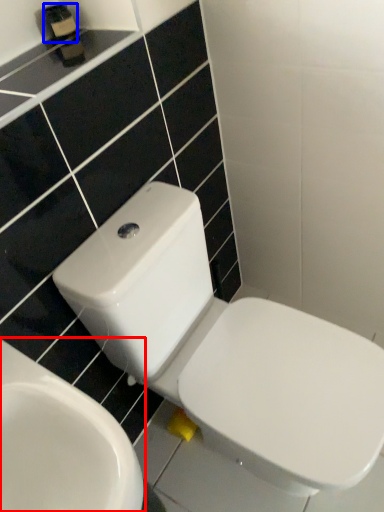
Question: Which of the following is the closest to the observer, toilet (highlighted by a red box) or toiletry (highlighted by a blue box)?

Choices:
 (A) toilet
 (B) toiletry

Answer: (A)